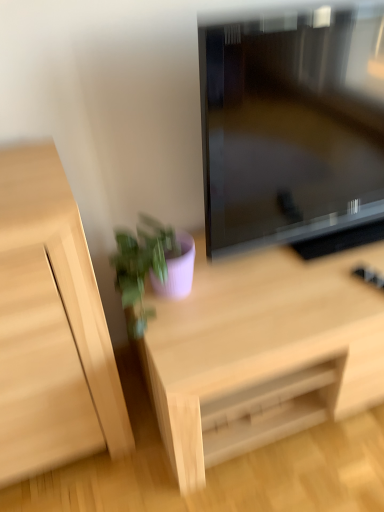
I want to click on free point above light wood desk at center (from a real-world perspective), so click(273, 284).